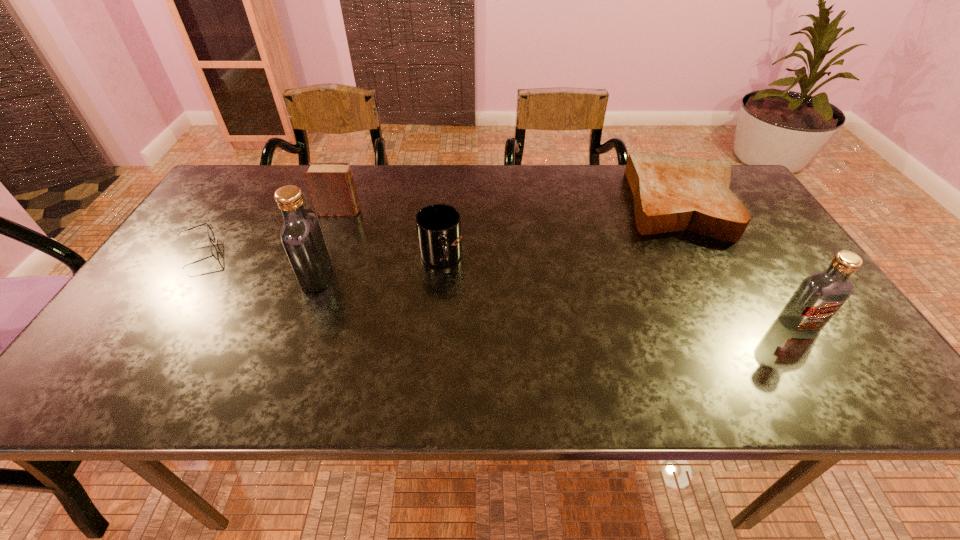
Locate an element on the screen. This screenshot has height=540, width=960. the taller vodka is located at coordinates (302, 237).

Locate an element on the screen. This screenshot has width=960, height=540. the tallest object is located at coordinates (302, 237).

The height and width of the screenshot is (540, 960). Identify the location of the second tallest object. (820, 295).

Where is `the right vodka`? The height and width of the screenshot is (540, 960). the right vodka is located at coordinates (820, 295).

What are the coordinates of `the fifth tallest object` in the screenshot? It's located at (671, 193).

At what (x,y) coordinates should I click in order to perform the action: click on the fourth tallest object. Please return your answer as a coordinate pair (x, y). Image resolution: width=960 pixels, height=540 pixels. Looking at the image, I should click on (438, 226).

You are a GUI agent. You are given a task and a screenshot of the screen. Output one action in this format:
    pyautogui.click(x=<x>, y=<y>)
    Task: Click on the third object from right to left
    
    Given the screenshot: What is the action you would take?
    pyautogui.click(x=438, y=226)

This screenshot has height=540, width=960. I want to click on diary, so click(331, 185).

Find the location of a particular element. The image size is (960, 540). the leftmost object is located at coordinates (214, 252).

Locate an element on the screen. spectacles is located at coordinates (214, 252).